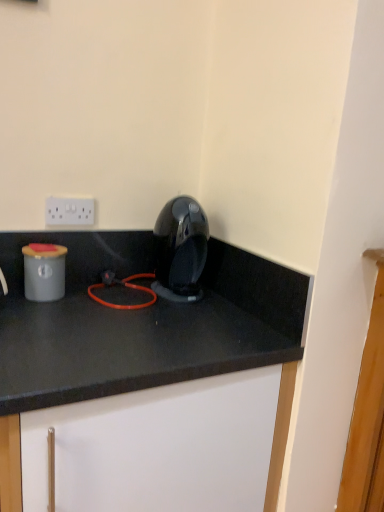
Find the location of a particular element. free location to the right of matte gray container at left is located at coordinates (91, 306).